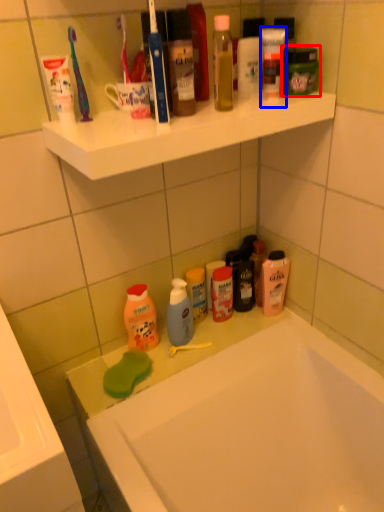
Question: Which point is further to the camera, mouthwash (highlighted by a red box) or toiletry (highlighted by a blue box)?

Choices:
 (A) mouthwash
 (B) toiletry

Answer: (A)